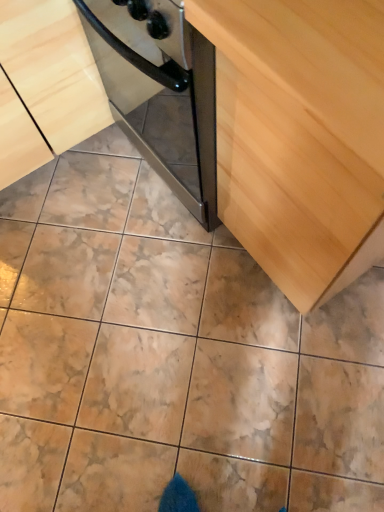
Question: Considering the relative sizes of light wood cabinet at center, which is the 2th cabinetry from right to left, and light wood cabinet at center, arranged as the second cabinetry when viewed from the left, in the image provided, is light wood cabinet at center, which is the 2th cabinetry from right to left, wider than light wood cabinet at center, arranged as the second cabinetry when viewed from the left,?

Choices:
 (A) no
 (B) yes

Answer: (A)

Question: Does light wood cabinet at center, arranged as the 1th cabinetry when viewed from the left, have a greater height compared to light wood cabinet at center, arranged as the second cabinetry when viewed from the left?

Choices:
 (A) yes
 (B) no

Answer: (B)

Question: Is light wood cabinet at center, arranged as the 1th cabinetry when viewed from the left, behind light wood cabinet at center, arranged as the second cabinetry when viewed from the left?

Choices:
 (A) yes
 (B) no

Answer: (A)

Question: From a real-world perspective, is light wood cabinet at center, which is the 2th cabinetry from right to left, below light wood cabinet at center, arranged as the second cabinetry when viewed from the left?

Choices:
 (A) yes
 (B) no

Answer: (A)

Question: Is the surface of light wood cabinet at center, which is the 2th cabinetry from right to left, in direct contact with light wood cabinet at center, arranged as the second cabinetry when viewed from the left?

Choices:
 (A) yes
 (B) no

Answer: (B)

Question: Is light wood cabinet at center, which is the 2th cabinetry from right to left, smaller than light wood cabinet at center, the first cabinetry from the right?

Choices:
 (A) yes
 (B) no

Answer: (B)

Question: Is light wood cabinet at center, the first cabinetry from the right, surrounding light wood cabinet at center, which is the 2th cabinetry from right to left?

Choices:
 (A) yes
 (B) no

Answer: (B)

Question: From a real-world perspective, is light wood cabinet at center, arranged as the second cabinetry when viewed from the left, over light wood cabinet at center, which is the 2th cabinetry from right to left?

Choices:
 (A) no
 (B) yes

Answer: (B)

Question: Are light wood cabinet at center, the first cabinetry from the right, and light wood cabinet at center, arranged as the 1th cabinetry when viewed from the left, far apart?

Choices:
 (A) no
 (B) yes

Answer: (A)

Question: From the image's perspective, is light wood cabinet at center, arranged as the second cabinetry when viewed from the left, located beneath light wood cabinet at center, arranged as the 1th cabinetry when viewed from the left?

Choices:
 (A) no
 (B) yes

Answer: (B)

Question: Is light wood cabinet at center, arranged as the second cabinetry when viewed from the left, positioned behind light wood cabinet at center, arranged as the 1th cabinetry when viewed from the left?

Choices:
 (A) no
 (B) yes

Answer: (A)

Question: Is light wood cabinet at center, arranged as the second cabinetry when viewed from the left, shorter than light wood cabinet at center, arranged as the 1th cabinetry when viewed from the left?

Choices:
 (A) yes
 (B) no

Answer: (B)

Question: Based on their positions, is light wood cabinet at center, the first cabinetry from the right, located to the left or right of light wood cabinet at center, which is the 2th cabinetry from right to left?

Choices:
 (A) right
 (B) left

Answer: (A)